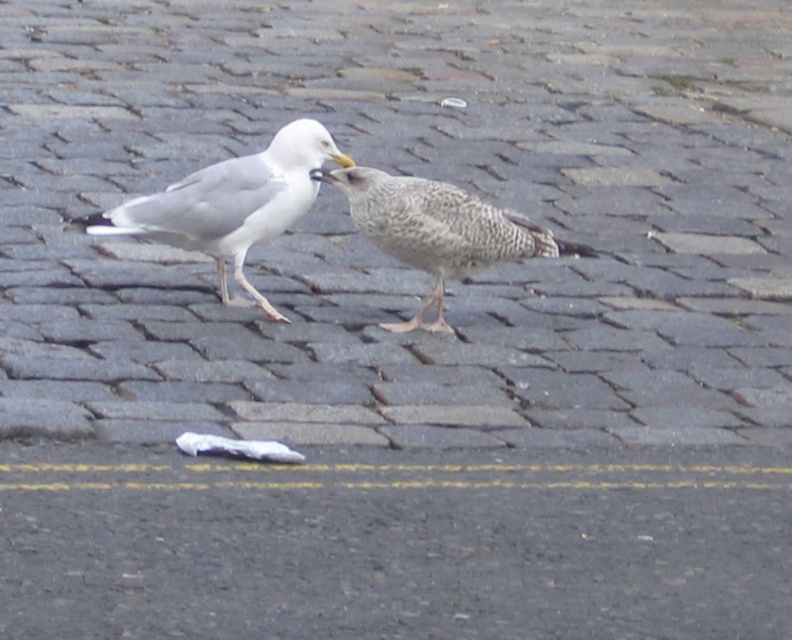
Can you confirm if white matte seagull at center is thinner than speckled feathered bird at center?

Yes, white matte seagull at center is thinner than speckled feathered bird at center.

Locate an element on the screen. Image resolution: width=792 pixels, height=640 pixels. white matte seagull at center is located at coordinates (230, 204).

What are the coordinates of `white matte seagull at center` in the screenshot? It's located at (230, 204).